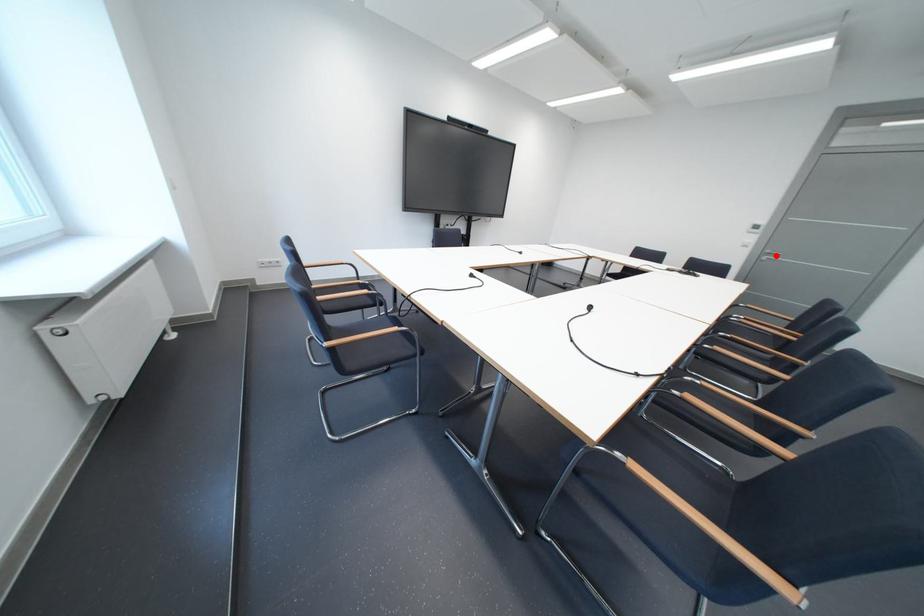
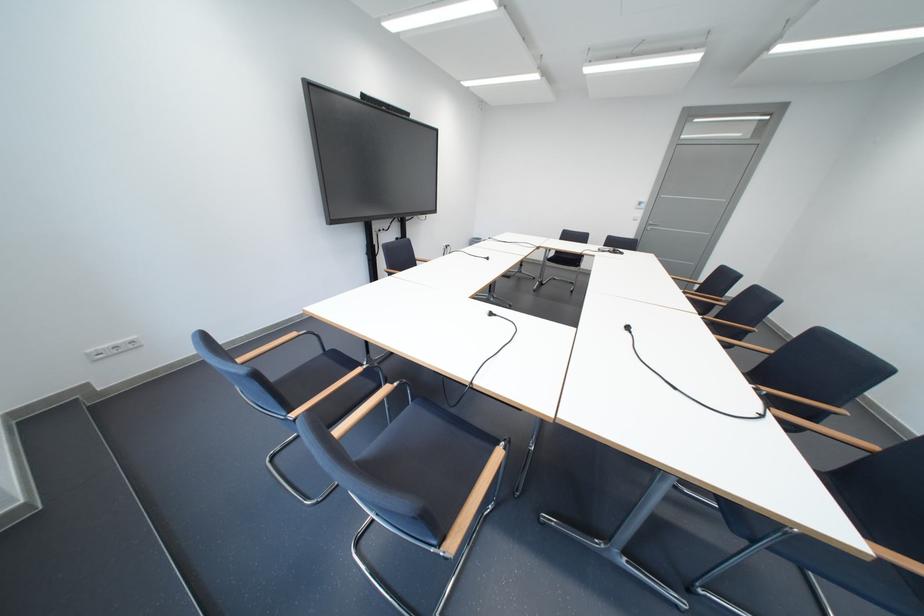
In the second image, find the point that corresponds to the highlighted location in the first image.

(660, 227)